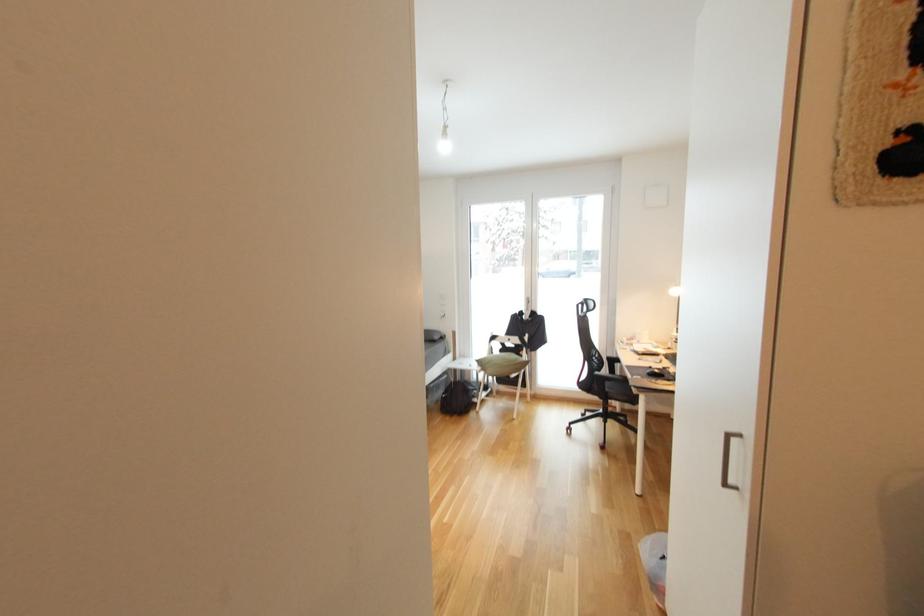
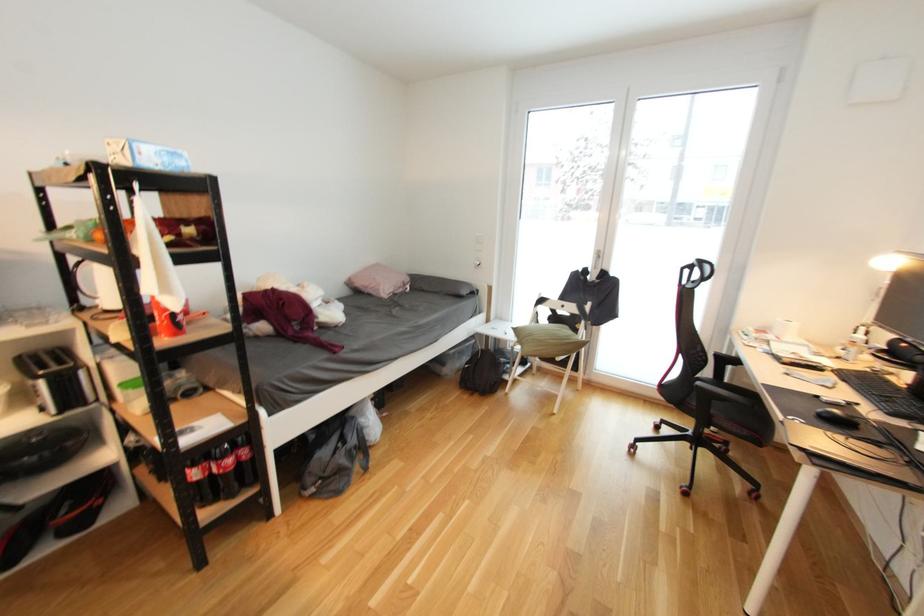
Question: What movement of the cameraman would produce the second image?

Choices:
 (A) Left
 (B) Right
 (C) Forward
 (D) Backward

Answer: (C)